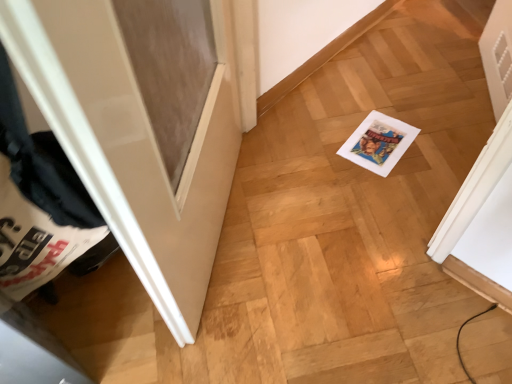
The image size is (512, 384). What do you see at coordinates (38, 201) in the screenshot?
I see `white fabric laundry at left` at bounding box center [38, 201].

Locate an element on the screen. This screenshot has height=384, width=512. white fabric laundry at left is located at coordinates (38, 201).

In order to click on white fabric laundry at left in this screenshot , I will do `click(38, 201)`.